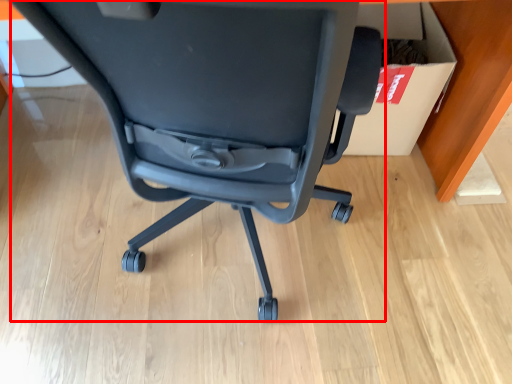
Question: Considering the relative positions of chair (annotated by the red box) and cardboard box in the image provided, where is chair (annotated by the red box) located with respect to the staircase?

Choices:
 (A) right
 (B) left

Answer: (B)